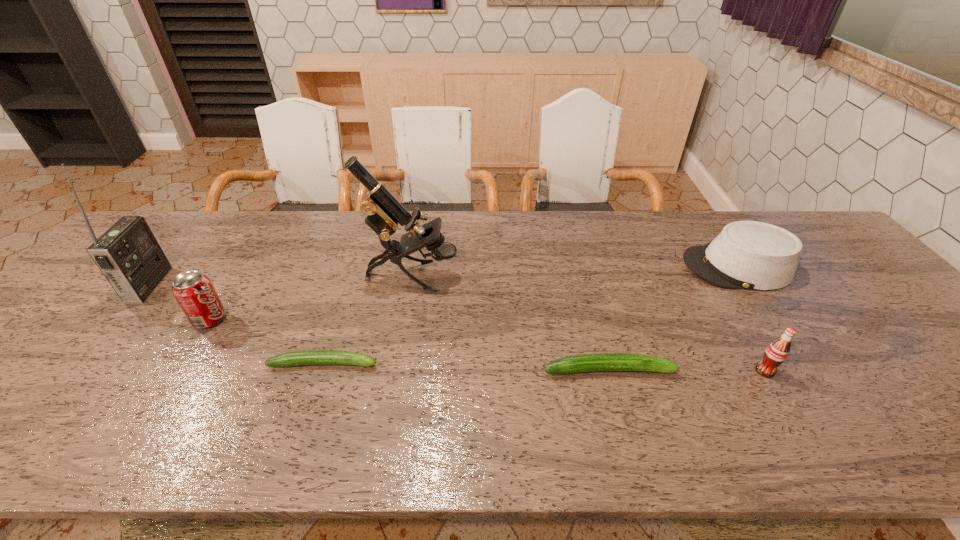
This screenshot has height=540, width=960. Find the location of `free space that satisfies the following two spatial constraints: 1. through the eyepiece of the right soda; 2. on the left side of the microscope`. free space that satisfies the following two spatial constraints: 1. through the eyepiece of the right soda; 2. on the left side of the microscope is located at coordinates (396, 371).

At what (x,y) coordinates should I click in order to perform the action: click on vacant space that satisfies the following two spatial constraints: 1. on the display of the farther soda; 2. on the right side of the leftmost object. Please return your answer as a coordinate pair (x, y). This screenshot has width=960, height=540. Looking at the image, I should click on (120, 319).